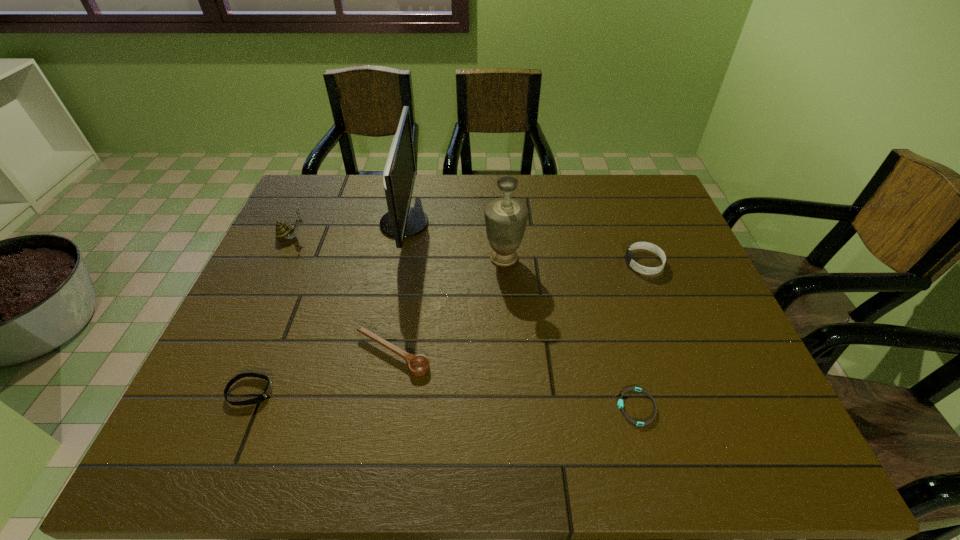
Image resolution: width=960 pixels, height=540 pixels. I want to click on vacant position at the left edge of the desktop, so click(x=332, y=228).

Find the location of a particular element. free space at the right edge is located at coordinates (680, 329).

This screenshot has height=540, width=960. Identify the location of free space at the far right corner of the desktop. click(x=641, y=190).

This screenshot has height=540, width=960. Find the location of `free space between the sixth tallest object and the fourth shortest object`. free space between the sixth tallest object and the fourth shortest object is located at coordinates (447, 327).

Find the location of a particular element. The width and height of the screenshot is (960, 540). vacant region between the leftmost wristband and the rightmost object is located at coordinates (447, 327).

Where is `free space between the sixth shortest object and the monitor`? free space between the sixth shortest object and the monitor is located at coordinates (454, 241).

Identify the location of blank region between the third tallest object and the rightmost wristband. This screenshot has width=960, height=540. (468, 250).

This screenshot has height=540, width=960. Find the location of `free space that is in between the snail and the second shortest wristband`. free space that is in between the snail and the second shortest wristband is located at coordinates (272, 314).

Where is `empty space between the fifth object from left to right and the shortest object`? This screenshot has height=540, width=960. empty space between the fifth object from left to right and the shortest object is located at coordinates (570, 333).

Find the location of a particular element. The height and width of the screenshot is (540, 960). free spot between the wooden spoon and the monitor is located at coordinates (398, 289).